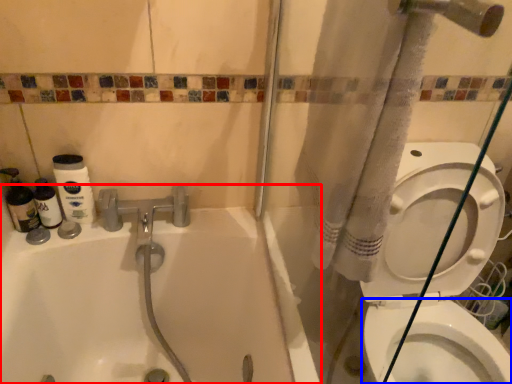
Question: Which point is closer to the camera, bathtub (highlighted by a red box) or bidet (highlighted by a blue box)?

Choices:
 (A) bathtub
 (B) bidet

Answer: (A)